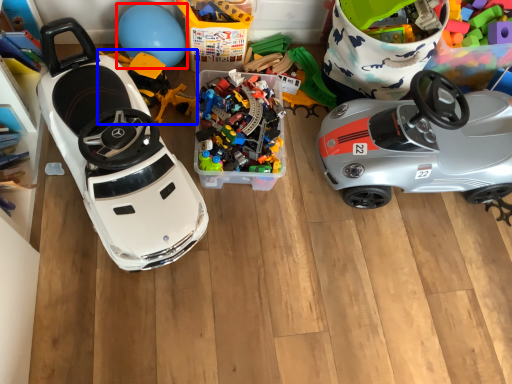
Question: Which of the following is the farthest to the observer, balloon (highlighted by a red box) or toy (highlighted by a blue box)?

Choices:
 (A) balloon
 (B) toy

Answer: (A)